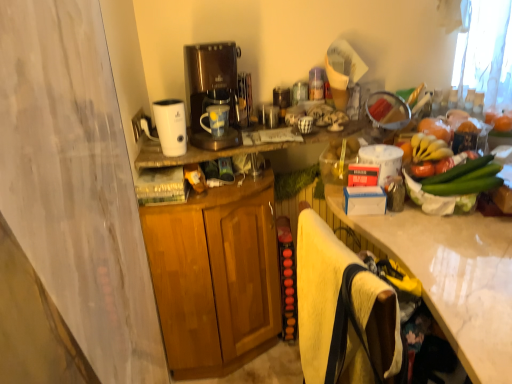
Image resolution: width=512 pixels, height=384 pixels. What are the coordinates of `spots to the right of white glossy humidifier at upper center` in the screenshot? It's located at [x=209, y=152].